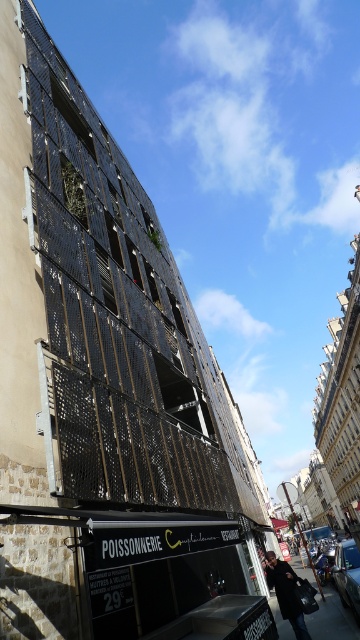
You are a delivery person who needs to unload a package that is 1.8 meters tall. You arrive at the POISSONNERIE storefront and see the metallic mesh construction at lower right and the dark brown leather coat at lower right. Can you determine if the package will fit between them vertically?

The metallic mesh construction at lower right is taller than the dark brown leather coat at lower right. Since the package is 1.8 meters tall, if the shorter object is the dark brown leather coat at lower right, then the package may not fit unless the coat is moved. However, without knowing the exact height of the coat, it is uncertain. But according to the description, the metallic mesh construction is taller, so the package might fit between them vertically if the space between them accommodates the 1.8m.

You are a delivery person standing in front of the POISSONNERIE storefront. You need to place a large package on the black perforated metal scaffolding at left and then move it to the dark brown leather coat at lower right. Can you carry the package from one point to the other without needing to go around any obstacles?

The black perforated metal scaffolding at left and dark brown leather coat at lower right are 8.73 meters apart. Since there are no obstacles mentioned in the scene description, you can carry the package directly between them.